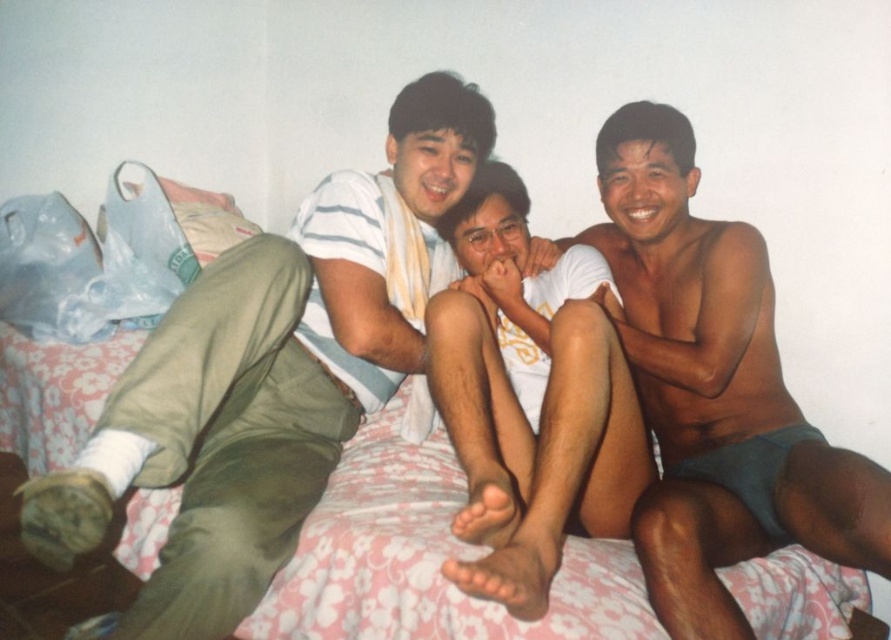
Question: Which point is closer to the camera taking this photo?

Choices:
 (A) (671, 513)
 (B) (503, 356)

Answer: (A)

Question: Considering the real-world distances, which object is farthest from the white cotton shirt at center?

Choices:
 (A) matte khaki pants at center
 (B) smooth skin torso at center

Answer: (A)

Question: Does smooth skin torso at center appear on the right side of white cotton shirt at center?

Choices:
 (A) yes
 (B) no

Answer: (A)

Question: Does matte khaki pants at center come behind white cotton shirt at center?

Choices:
 (A) no
 (B) yes

Answer: (B)

Question: Which point is farther from the camera taking this photo?

Choices:
 (A) (593, 433)
 (B) (623, 321)

Answer: (B)

Question: Is matte khaki pants at center in front of smooth skin torso at center?

Choices:
 (A) no
 (B) yes

Answer: (B)